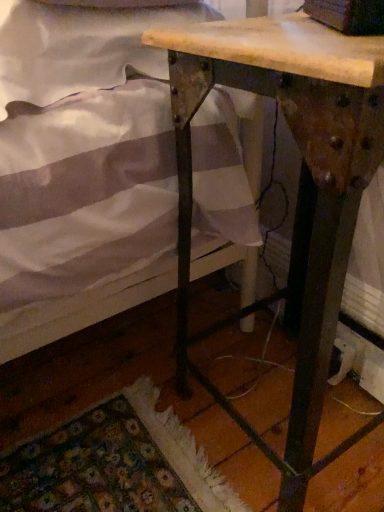
This screenshot has width=384, height=512. What do you see at coordinates (299, 182) in the screenshot? I see `wooden table at center` at bounding box center [299, 182].

Where is `wooden table at center`? wooden table at center is located at coordinates (299, 182).

Find the location of `wooden table at center`. wooden table at center is located at coordinates (299, 182).